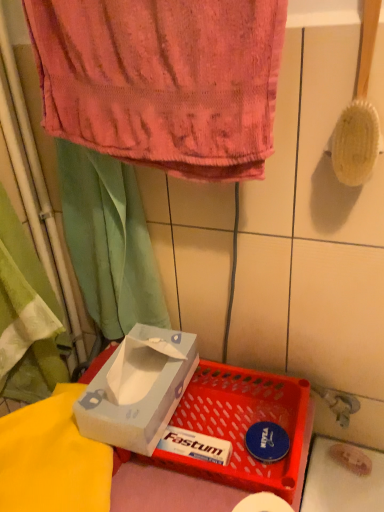
Question: From the image's perspective, is pink terry cloth towel at upper center located above green fabric curtain at upper left?

Choices:
 (A) no
 (B) yes

Answer: (B)

Question: Are pink terry cloth towel at upper center and green fabric curtain at upper left located far from each other?

Choices:
 (A) no
 (B) yes

Answer: (A)

Question: Is pink terry cloth towel at upper center touching green fabric curtain at upper left?

Choices:
 (A) no
 (B) yes

Answer: (A)

Question: Could green fabric curtain at upper left be considered to be inside pink terry cloth towel at upper center?

Choices:
 (A) yes
 (B) no

Answer: (B)

Question: Considering the relative positions of pink terry cloth towel at upper center and green fabric curtain at upper left in the image provided, is pink terry cloth towel at upper center behind green fabric curtain at upper left?

Choices:
 (A) no
 (B) yes

Answer: (A)

Question: Looking at their shapes, would you say green fabric curtain at upper left is wider or thinner than pink terry cloth towel at upper center?

Choices:
 (A) wide
 (B) thin

Answer: (A)

Question: From the image's perspective, is green fabric curtain at upper left above or below pink terry cloth towel at upper center?

Choices:
 (A) above
 (B) below

Answer: (B)

Question: Is green fabric curtain at upper left bigger or smaller than pink terry cloth towel at upper center?

Choices:
 (A) big
 (B) small

Answer: (A)

Question: Is point (114, 310) positioned closer to the camera than point (261, 103)?

Choices:
 (A) farther
 (B) closer

Answer: (A)

Question: From the image's perspective, is light blue cardboard tissue box at center positioned above or below wooden bristles brush at upper right?

Choices:
 (A) below
 (B) above

Answer: (A)

Question: Is light blue cardboard tissue box at center situated inside wooden bristles brush at upper right or outside?

Choices:
 (A) inside
 (B) outside

Answer: (B)

Question: In terms of width, does light blue cardboard tissue box at center look wider or thinner when compared to wooden bristles brush at upper right?

Choices:
 (A) thin
 (B) wide

Answer: (B)

Question: From a real-world perspective, is light blue cardboard tissue box at center positioned above or below wooden bristles brush at upper right?

Choices:
 (A) above
 (B) below

Answer: (B)

Question: Which is correct: green fabric curtain at upper left is inside wooden bristles brush at upper right, or outside of it?

Choices:
 (A) inside
 (B) outside

Answer: (B)

Question: Is green fabric curtain at upper left bigger or smaller than wooden bristles brush at upper right?

Choices:
 (A) small
 (B) big

Answer: (B)